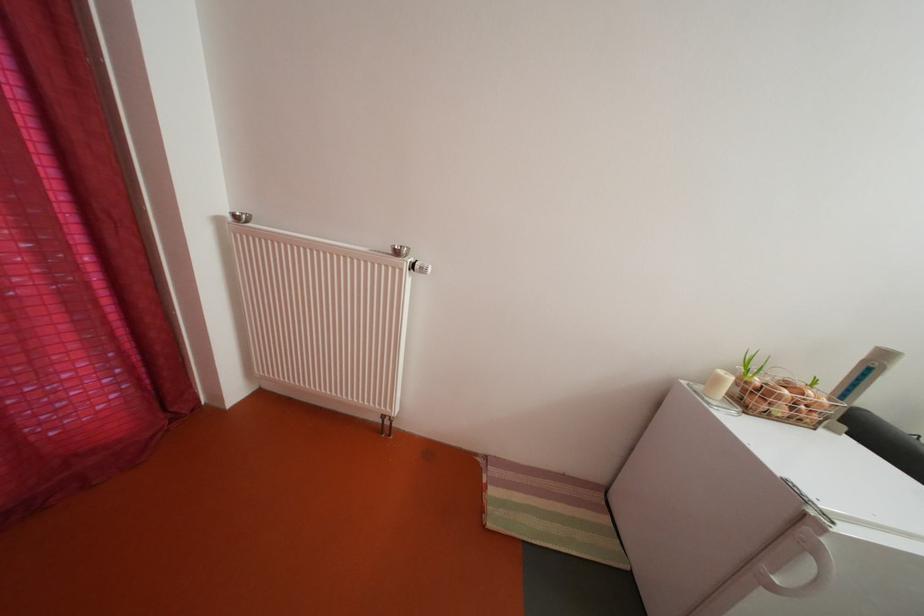
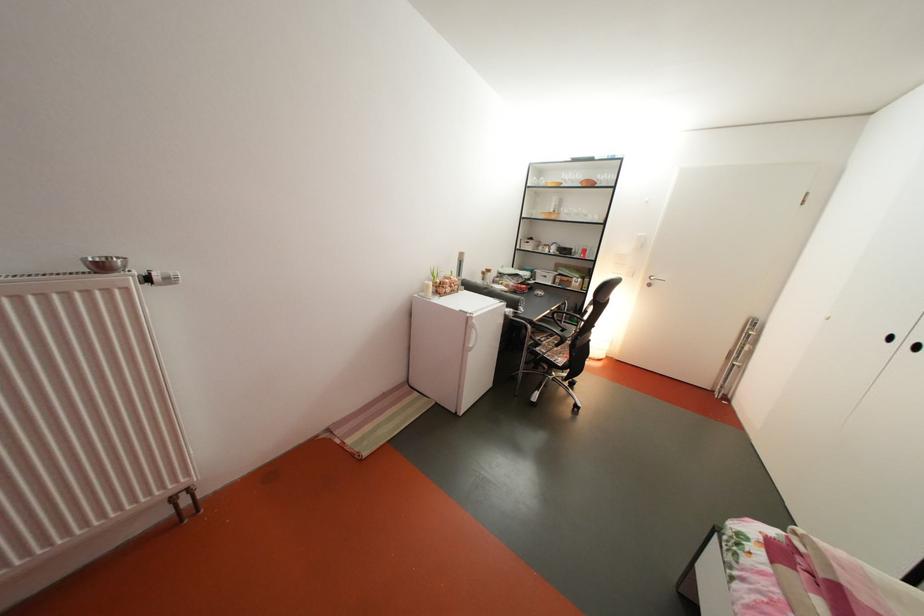
Where in the second image is the point corresponding to point 429,273 from the first image?

(168, 285)